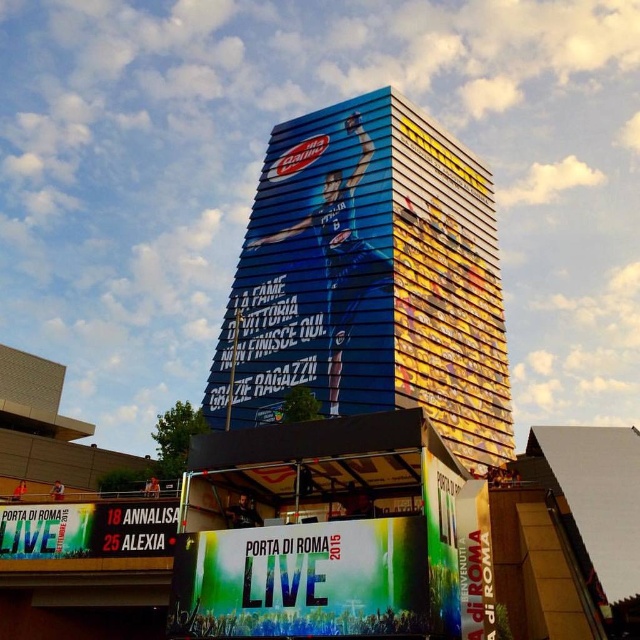
Does blue glossy building at center appear over green fabric banner at lower center?

Indeed, blue glossy building at center is positioned over green fabric banner at lower center.

You are a GUI agent. You are given a task and a screenshot of the screen. Output one action in this format:
    pyautogui.click(x=<x>, y=<y>)
    Task: Click on the blue glossy building at center
    
    Given the screenshot: What is the action you would take?
    pyautogui.click(x=369, y=280)

The height and width of the screenshot is (640, 640). I want to click on blue glossy building at center, so click(369, 280).

Between green fabric banner at lower center and white plastic scoreboard at center, which one is positioned lower?

white plastic scoreboard at center

Can you confirm if green fabric banner at lower center is wider than white plastic scoreboard at center?

Correct, the width of green fabric banner at lower center exceeds that of white plastic scoreboard at center.

Image resolution: width=640 pixels, height=640 pixels. Describe the element at coordinates (301, 579) in the screenshot. I see `green fabric banner at lower center` at that location.

The width and height of the screenshot is (640, 640). Identify the location of green fabric banner at lower center. coord(301,579).

Does green fabric banner at center appear over white plastic scoreboard at center?

No, green fabric banner at center is not above white plastic scoreboard at center.

How much distance is there between green fabric banner at center and white plastic scoreboard at center?

2.59 meters

Between point (77, 513) and point (125, 502), which one is positioned behind?

The point (125, 502) is behind.

Identify the location of green fabric banner at center. (45, 529).